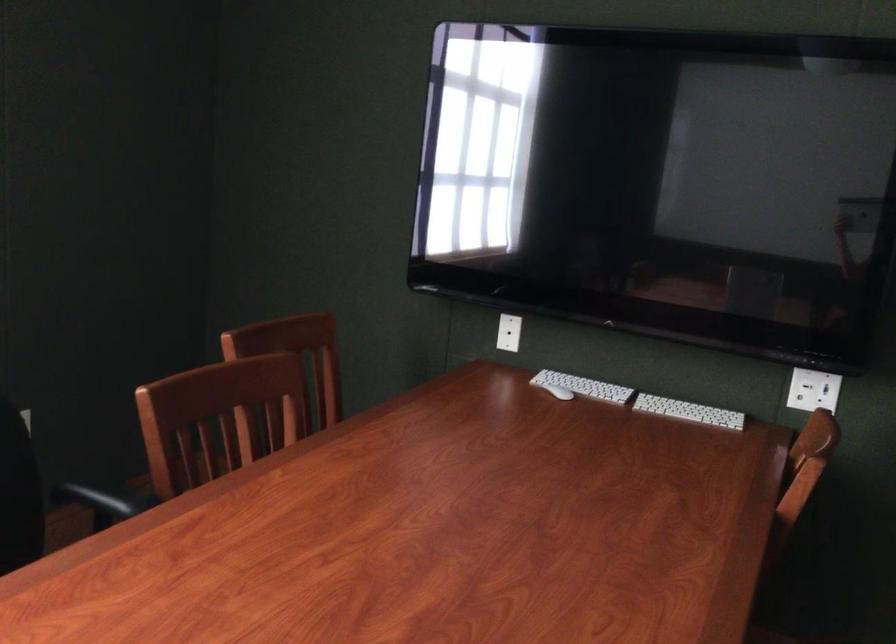
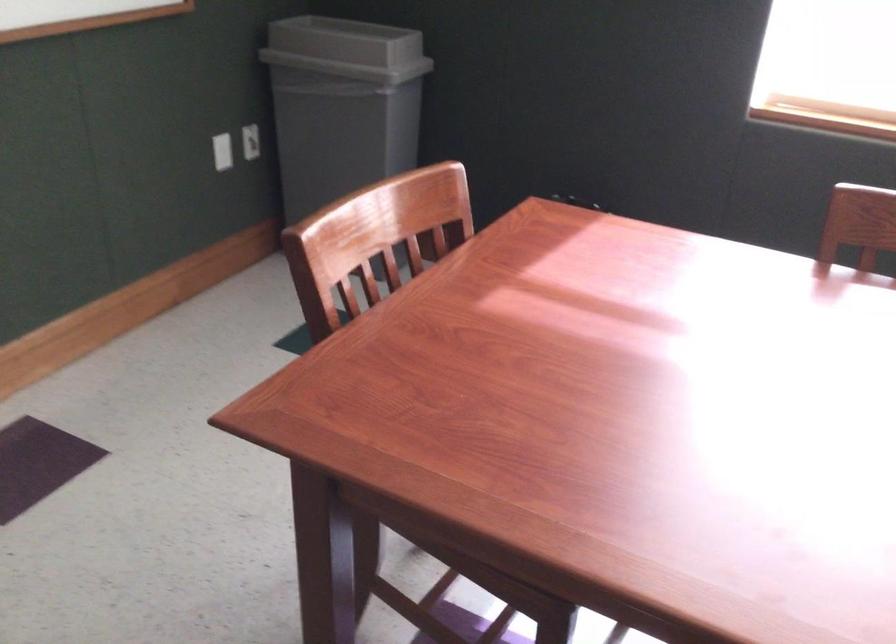
Based on the continuous images, in which direction is the camera rotating?

→ The camera rotated toward left-down.